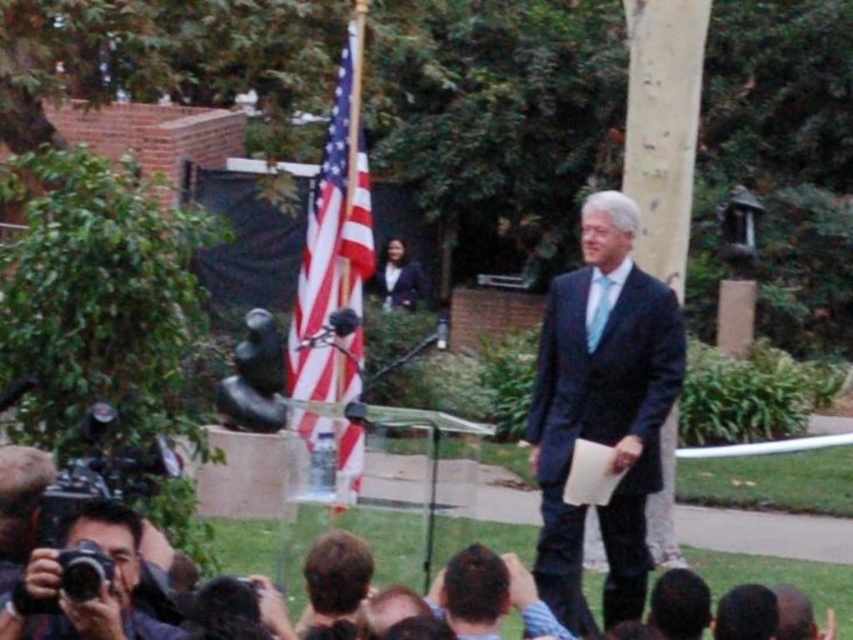
You are a photographer at the event and need to capture a clear shot of both the dark blue suit at center and the matte black suit at center. Since you have a limited field of view, which suit should you focus on to ensure it fits within your camera frame?

The dark blue suit at center is smaller than the matte black suit at center, so focusing on the matte black suit at center would ensure it fits within the camera frame as it takes up more space.

You are a fashion journalist attending an event and notice two suits worn by speakers on the stage. You see a dark blue suit at center and a matte black suit at center. Which speaker is wearing a narrower suit?

The dark blue suit at center has a smaller width than the matte black suit at center, so the speaker wearing the dark blue suit at center is wearing the narrower suit.

From the picture: You are attending a public event and notice the american flag at center and the light blue silk tie at center. From your perspective, which object is positioned to the left?

The american flag at center is positioned to the left of the light blue silk tie at center.